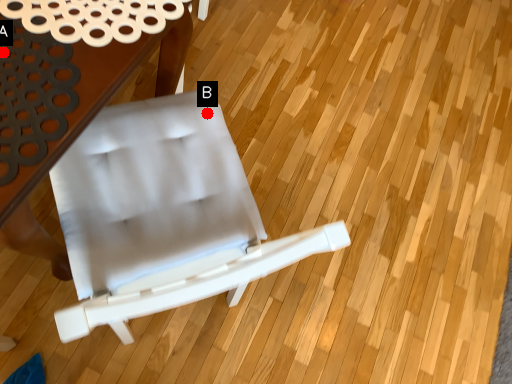
Question: Two points are circled on the image, labeled by A and B beside each circle. Which point is farther from the camera taking this photo?

Choices:
 (A) A is further
 (B) B is further

Answer: (B)